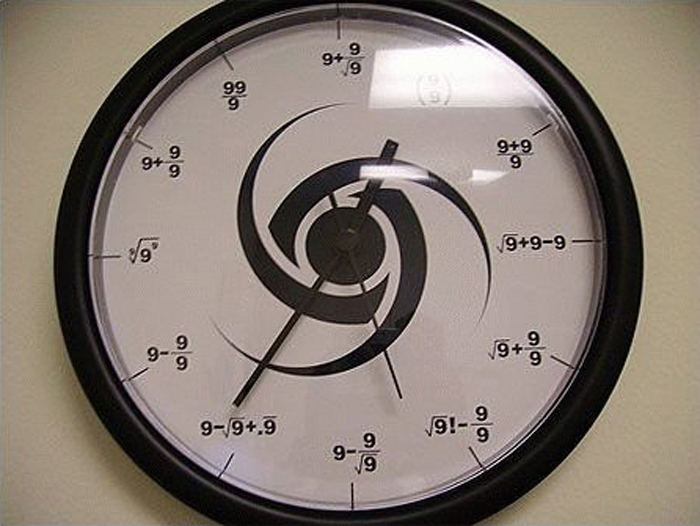
What are the coordinates of `round black frame` in the screenshot? It's located at (x=70, y=202).